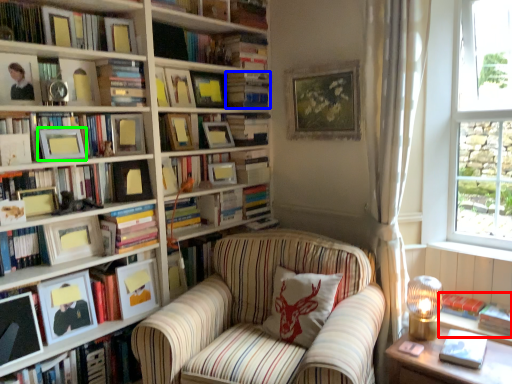
Question: Which object is positioned farthest from book (highlighted by a red box)? Select from book (highlighted by a blue box) and picture frame (highlighted by a green box).

Choices:
 (A) book
 (B) picture frame

Answer: (B)